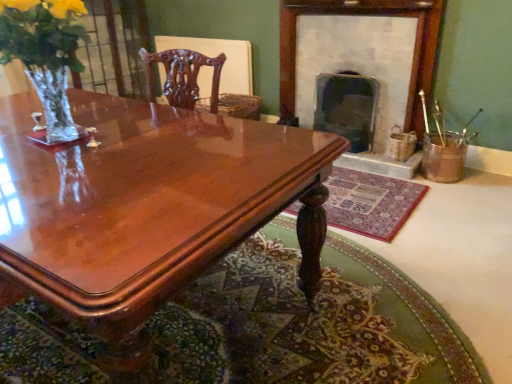
Question: Considering the positions of shiny brown wood coffee table at center and carpeted mat at lower center, the 1th mat from the top, in the image, is shiny brown wood coffee table at center taller or shorter than carpeted mat at lower center, the 1th mat from the top,?

Choices:
 (A) short
 (B) tall

Answer: (B)

Question: In the image, is shiny brown wood coffee table at center positioned in front of or behind carpeted mat at lower center, the second mat from the bottom?

Choices:
 (A) behind
 (B) front

Answer: (B)

Question: Which of these objects is positioned closest to the carpeted mat at lower center, the 1th mat from the top?

Choices:
 (A) shiny brown wood coffee table at center
 (B) dark gray stone fireplace at center, acting as the 2th fireplace starting from the left
 (C) clear glass vase at left
 (D) smooth stone fireplace at upper right, which ranks as the 1th fireplace in left-to-right order
 (E) mahogany wood chair at upper center

Answer: (B)

Question: Which object is positioned farthest from the shiny brown wood coffee table at center?

Choices:
 (A) carpeted mat at lower center, the 1th mat from the top
 (B) mahogany wood chair at upper center
 (C) smooth stone fireplace at upper right, which ranks as the 1th fireplace in left-to-right order
 (D) clear glass vase at left
 (E) dark gray stone fireplace at center, acting as the 2th fireplace starting from the left

Answer: (C)